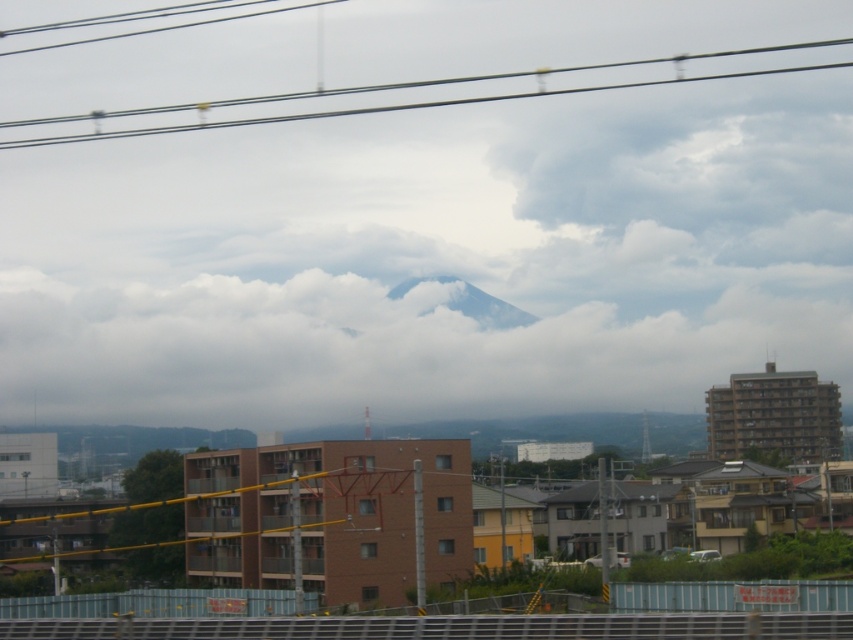
Is point (277, 416) positioned after point (161, 129)?

That is False.

Is white fluffy cloud at center wider than metallic wire at upper center?

No, white fluffy cloud at center is not wider than metallic wire at upper center.

This screenshot has width=853, height=640. What do you see at coordinates (375, 352) in the screenshot?
I see `white fluffy cloud at center` at bounding box center [375, 352].

In order to click on white fluffy cloud at center in this screenshot , I will do pos(375,352).

Which is behind, point (732, 52) or point (479, 305)?

The point (732, 52) is behind.

Who is higher up, metallic wire at upper center or gray/cloudy mountain at center?

metallic wire at upper center is higher up.

Image resolution: width=853 pixels, height=640 pixels. Find the location of `metallic wire at upper center`. metallic wire at upper center is located at coordinates (434, 84).

Who is lower down, white fluffy cloud at center or gray/cloudy mountain at center?

white fluffy cloud at center is lower down.

Describe the element at coordinates (375, 352) in the screenshot. I see `white fluffy cloud at center` at that location.

Does point (425, 403) lie in front of point (398, 292)?

Yes, point (425, 403) is in front of point (398, 292).

In order to click on white fluffy cloud at center in this screenshot , I will do `click(375, 352)`.